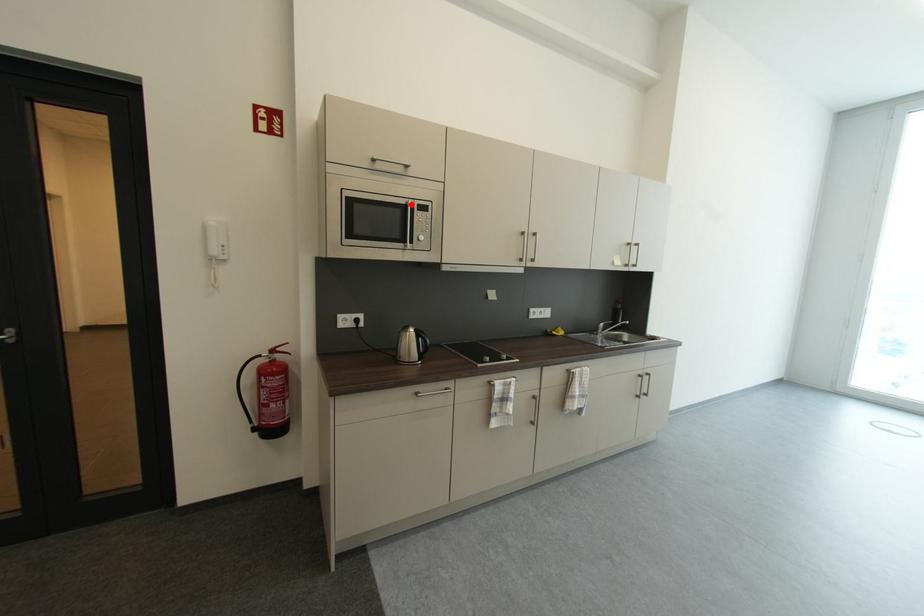
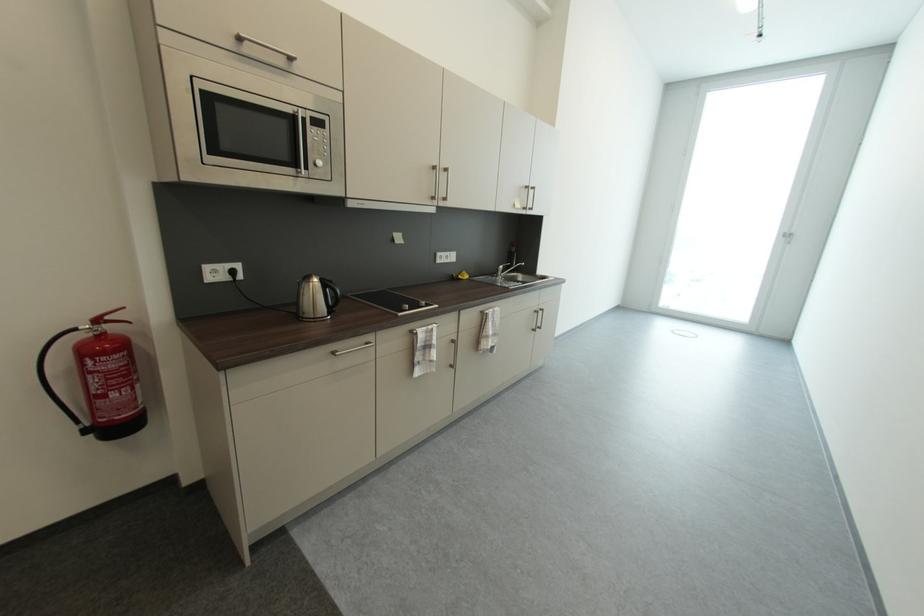
Locate, in the second image, the point that corresponds to the highlighted location in the first image.

(297, 113)